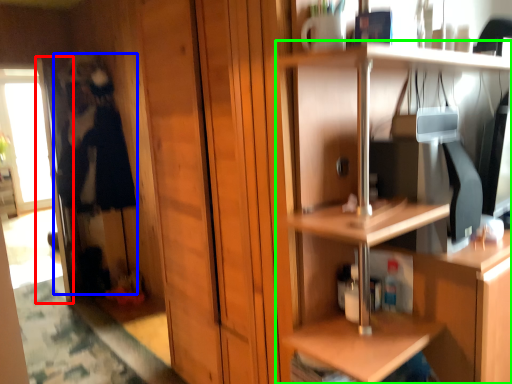
Question: Based on their relative distances, which object is nearer to screen door (highlighted by a red box)? Choose from person (highlighted by a blue box) and shelf (highlighted by a green box).

Choices:
 (A) person
 (B) shelf

Answer: (A)